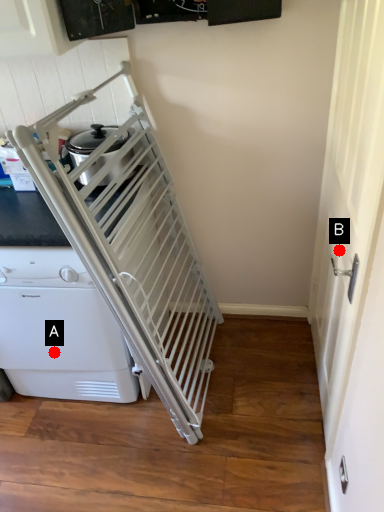
Question: Two points are circled on the image, labeled by A and B beside each circle. Which point appears farthest from the camera in this image?

Choices:
 (A) A is further
 (B) B is further

Answer: (A)